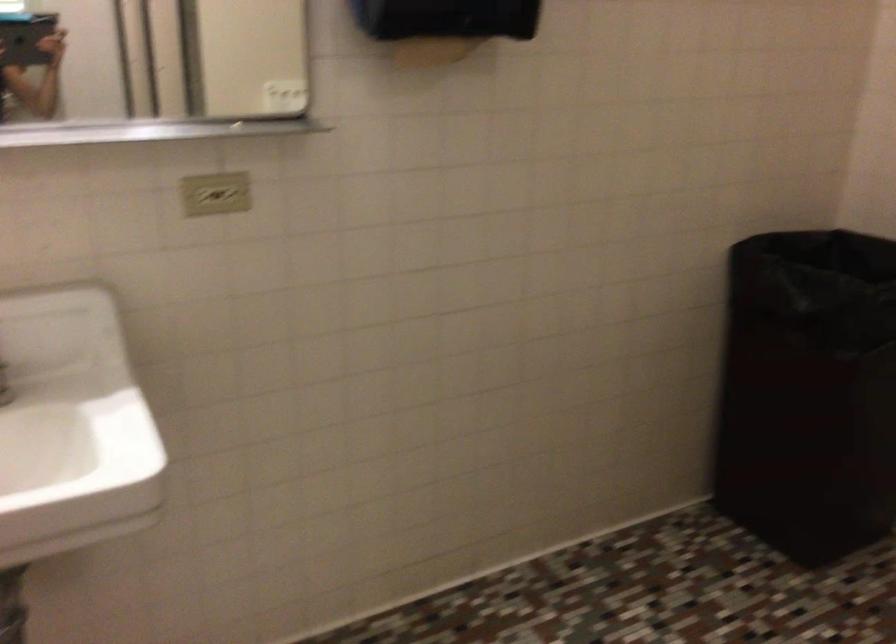
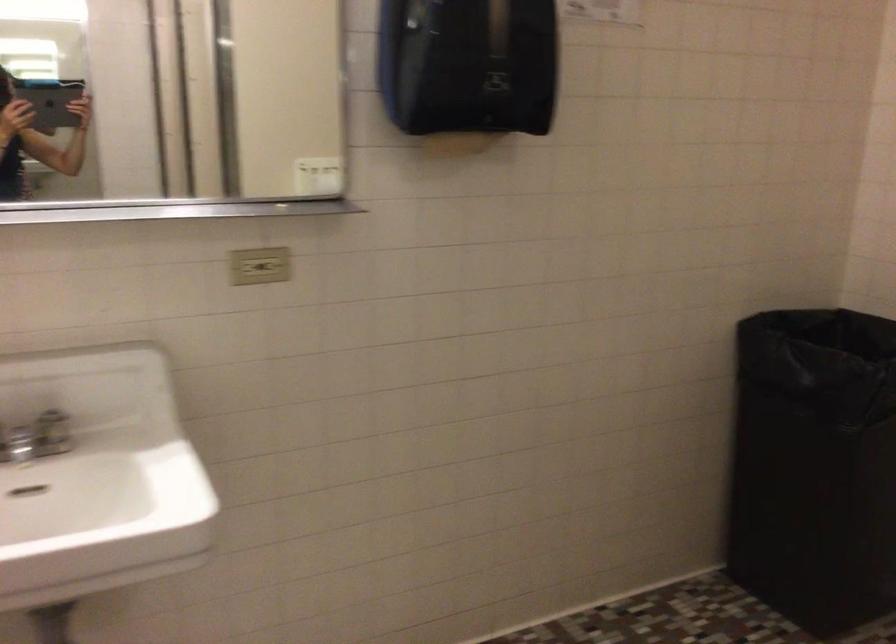
In the second image, find the point that corresponds to point 228,196 in the first image.

(273, 266)